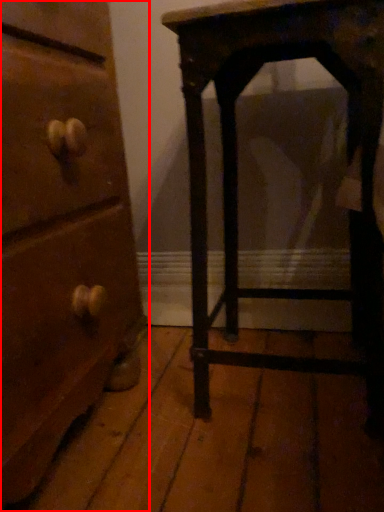
Question: From the image's perspective, considering the relative positions of chest of drawers (annotated by the red box) and furniture in the image provided, where is chest of drawers (annotated by the red box) located with respect to the staircase?

Choices:
 (A) above
 (B) below

Answer: (B)